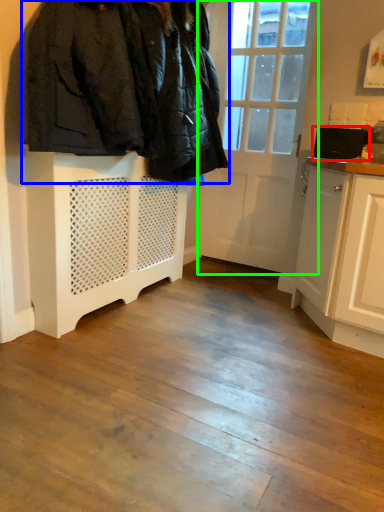
Question: Considering the real-world distances, which object is farthest from appliance (highlighted by a red box)? furniture (highlighted by a blue box) or door (highlighted by a green box)?

Choices:
 (A) furniture
 (B) door

Answer: (A)